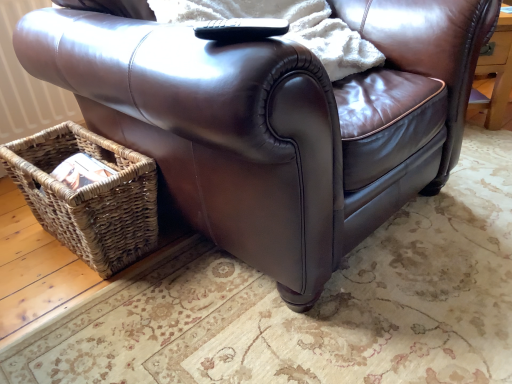
Question: Is woven brown picnic basket at lower left in front of or behind black plastic remote at upper center in the image?

Choices:
 (A) front
 (B) behind

Answer: (B)

Question: From a real-world perspective, is woven brown picnic basket at lower left physically located above or below black plastic remote at upper center?

Choices:
 (A) below
 (B) above

Answer: (A)

Question: Is woven brown picnic basket at lower left inside or outside of black plastic remote at upper center?

Choices:
 (A) outside
 (B) inside

Answer: (A)

Question: Is black plastic remote at upper center taller or shorter than woven brown picnic basket at lower left?

Choices:
 (A) tall
 (B) short

Answer: (B)

Question: Is black plastic remote at upper center in front of or behind woven brown picnic basket at lower left in the image?

Choices:
 (A) behind
 (B) front

Answer: (B)

Question: Looking at their shapes, would you say black plastic remote at upper center is wider or thinner than woven brown picnic basket at lower left?

Choices:
 (A) wide
 (B) thin

Answer: (B)

Question: Is black plastic remote at upper center spatially inside woven brown picnic basket at lower left, or outside of it?

Choices:
 (A) inside
 (B) outside

Answer: (B)